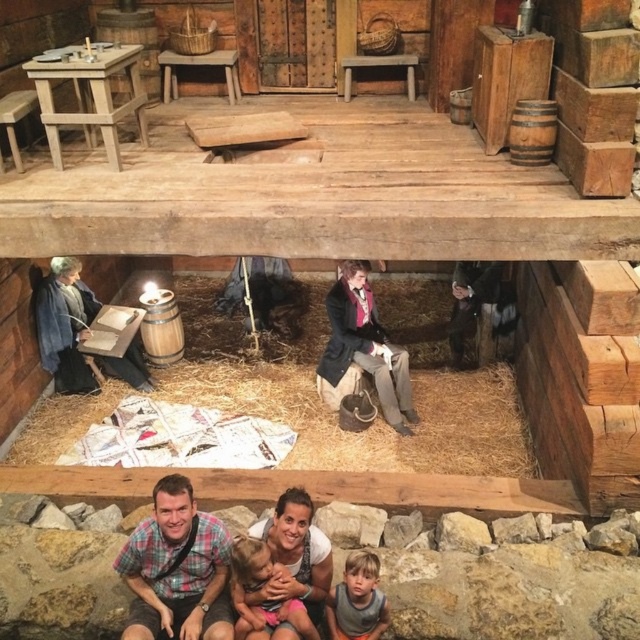
You are a tailor measuring two garments in the rustic indoor setting. The plaid fabric shirt at lower center and the smooth brown coat at center are both in front of you. Which garment has a smaller width?

The plaid fabric shirt at lower center has a smaller width than the smooth brown coat at center according to the description.